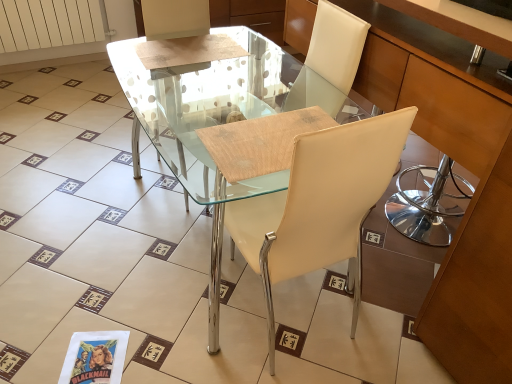
Measure the distance between point (487, 199) and camera.

3.82 feet.

What do you see at coordinates (465, 167) in the screenshot?
I see `matte wood cabinet at center` at bounding box center [465, 167].

Find the location of a particular element. This screenshot has height=384, width=512. white matte radiator at upper left is located at coordinates (48, 23).

Does matte white chair at center lie behind white matte radiator at upper left?

No, matte white chair at center is closer to the camera.

Is matte white chair at center not inside white matte radiator at upper left?

Yes.

Considering the relative positions of matte white chair at center and white matte radiator at upper left in the image provided, is matte white chair at center to the right of white matte radiator at upper left from the viewer's perspective?

Yes, matte white chair at center is to the right of white matte radiator at upper left.

The height and width of the screenshot is (384, 512). Identify the location of chair to the right of white matte radiator at upper left. (320, 205).

Is transparent glass table at center outside of matte wood cabinet at center?

Yes, transparent glass table at center is outside of matte wood cabinet at center.

From a real-world perspective, is transparent glass table at center on top of matte wood cabinet at center?

No, from a real-world perspective, transparent glass table at center is not over matte wood cabinet at center

Which is in front, point (218, 281) or point (457, 242)?

The point (457, 242) is more forward.

Who is taller, transparent glass table at center or matte wood cabinet at center?

Standing taller between the two is matte wood cabinet at center.

Is white matte radiator at upper left positioned far away from transparent glass table at center?

Yes, white matte radiator at upper left is far from transparent glass table at center.

From a real-world perspective, who is located lower, white matte radiator at upper left or transparent glass table at center?

From a 3D spatial view, white matte radiator at upper left is below.

Is white matte radiator at upper left at the left side of transparent glass table at center?

Indeed, white matte radiator at upper left is positioned on the left side of transparent glass table at center.

Considering the positions of objects white matte radiator at upper left and transparent glass table at center in the image provided, who is behind, white matte radiator at upper left or transparent glass table at center?

Positioned behind is white matte radiator at upper left.

You are a GUI agent. You are given a task and a screenshot of the screen. Output one action in this format:
    pyautogui.click(x=<x>, y=<y>)
    Task: Click on the desk below the matte wood cabinet at center (from a real-world perspective)
    This screenshot has width=512, height=384.
    Given the screenshot: What is the action you would take?
    pyautogui.click(x=224, y=126)

From the picture: From a real-world perspective, who is located lower, matte wood cabinet at center or transparent glass table at center?

transparent glass table at center.

Considering the positions of objects matte wood cabinet at center and transparent glass table at center in the image provided, who is more to the right, matte wood cabinet at center or transparent glass table at center?

matte wood cabinet at center.

Is matte wood cabinet at center far away from transparent glass table at center?

No.

Considering the relative positions of matte wood cabinet at center and white matte radiator at upper left in the image provided, is matte wood cabinet at center to the left of white matte radiator at upper left from the viewer's perspective?

In fact, matte wood cabinet at center is to the right of white matte radiator at upper left.

Do you think matte wood cabinet at center is within white matte radiator at upper left, or outside of it?

matte wood cabinet at center lies outside white matte radiator at upper left.

From the picture: Which is farther, (306, 1) or (54, 9)?

The point (54, 9) is more distant.

This screenshot has height=384, width=512. Identify the location of radiator that appears above the matte wood cabinet at center (from the image's perspective). (48, 23).

Is matte wood cabinet at center at the back of matte white chair at center?

matte white chair at center does not have its back to matte wood cabinet at center.

Locate an element on the screen. The image size is (512, 384). cabinetry lying on the right of matte white chair at center is located at coordinates (465, 167).

Can you confirm if matte white chair at center is smaller than matte wood cabinet at center?

Indeed, matte white chair at center has a smaller size compared to matte wood cabinet at center.

Which object is closer to the camera taking this photo, matte white chair at center or matte wood cabinet at center?

Positioned in front is matte white chair at center.

This screenshot has width=512, height=384. In order to click on cabinetry positioned vertically above the matte white chair at center (from a real-world perspective) in this screenshot , I will do `click(465, 167)`.

From the image's perspective, between matte wood cabinet at center and matte white chair at center, who is located below?

From the image's view, matte white chair at center is below.

From a real-world perspective, is matte wood cabinet at center located beneath matte white chair at center?

No, from a real-world perspective, matte wood cabinet at center is not under matte white chair at center.

Does matte wood cabinet at center lie behind matte white chair at center?

That is True.

What are the coordinates of `chair that is on the right side of white matte radiator at upper left` in the screenshot? It's located at (320, 205).

Identify the location of cabinetry above the transparent glass table at center (from the image's perspective). (465, 167).

Which object lies further to the anchor point transparent glass table at center, white matte radiator at upper left or matte wood cabinet at center?

white matte radiator at upper left is positioned further to the anchor transparent glass table at center.

From the picture: Considering their positions, is white matte radiator at upper left positioned further to transparent glass table at center than matte white chair at center?

white matte radiator at upper left lies further to transparent glass table at center than the other object.

When comparing their distances from matte wood cabinet at center, does transparent glass table at center or matte white chair at center seem closer?

matte white chair at center is positioned closer to the anchor matte wood cabinet at center.

Which object lies nearer to the anchor point matte white chair at center, matte wood cabinet at center or transparent glass table at center?

transparent glass table at center.

Based on their spatial positions, is matte wood cabinet at center or white matte radiator at upper left further from transparent glass table at center?

white matte radiator at upper left is further to transparent glass table at center.

Based on the photo, estimate the real-world distances between objects in this image. Which object is further from transparent glass table at center, matte wood cabinet at center or matte white chair at center?

matte wood cabinet at center is positioned further to the anchor transparent glass table at center.

Consider the image. Which object lies further to the anchor point matte wood cabinet at center, matte white chair at center or transparent glass table at center?

Among the two, transparent glass table at center is located further to matte wood cabinet at center.

Considering their positions, is matte white chair at center positioned closer to transparent glass table at center than white matte radiator at upper left?

matte white chair at center lies closer to transparent glass table at center than the other object.

Locate an element on the screen. The image size is (512, 384). desk between matte white chair at center and white matte radiator at upper left along the z-axis is located at coordinates (224, 126).

This screenshot has height=384, width=512. What are the coordinates of `cabinetry located between matte white chair at center and white matte radiator at upper left in the depth direction` in the screenshot? It's located at (465, 167).

Image resolution: width=512 pixels, height=384 pixels. I want to click on desk between matte wood cabinet at center and white matte radiator at upper left from front to back, so click(224, 126).

Locate an element on the screen. This screenshot has width=512, height=384. chair between transparent glass table at center and matte wood cabinet at center from left to right is located at coordinates (320, 205).